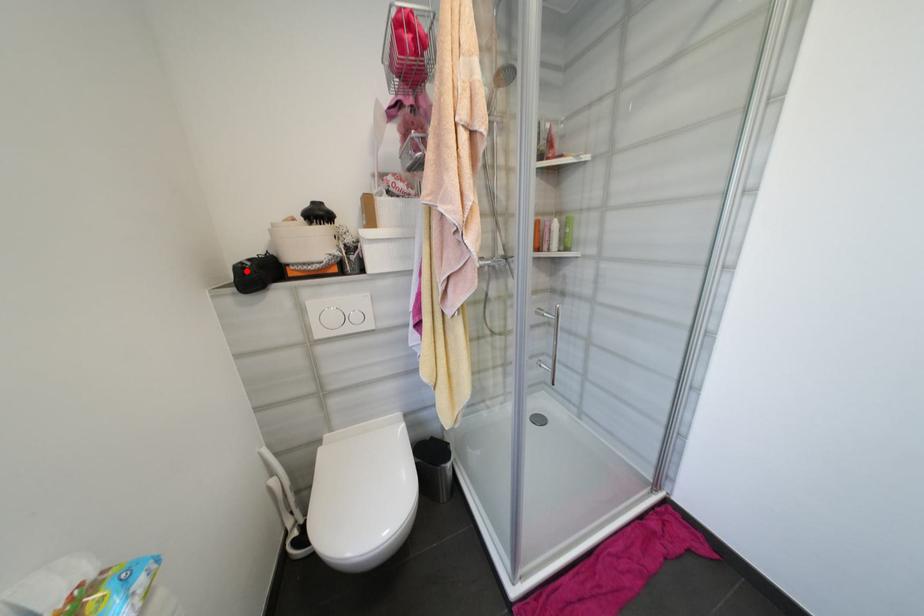
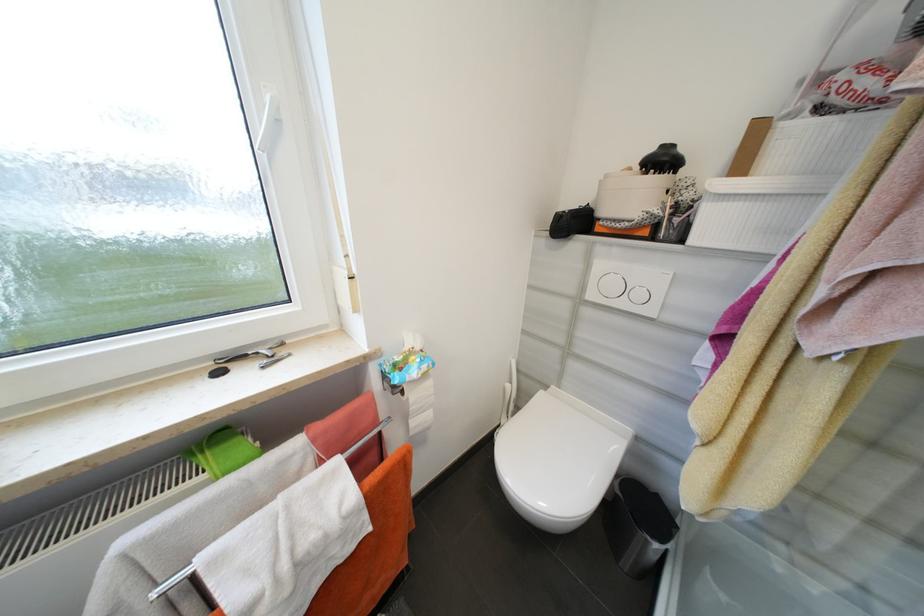
Locate, in the second image, the point that corresponds to the highlighted location in the first image.

(565, 217)